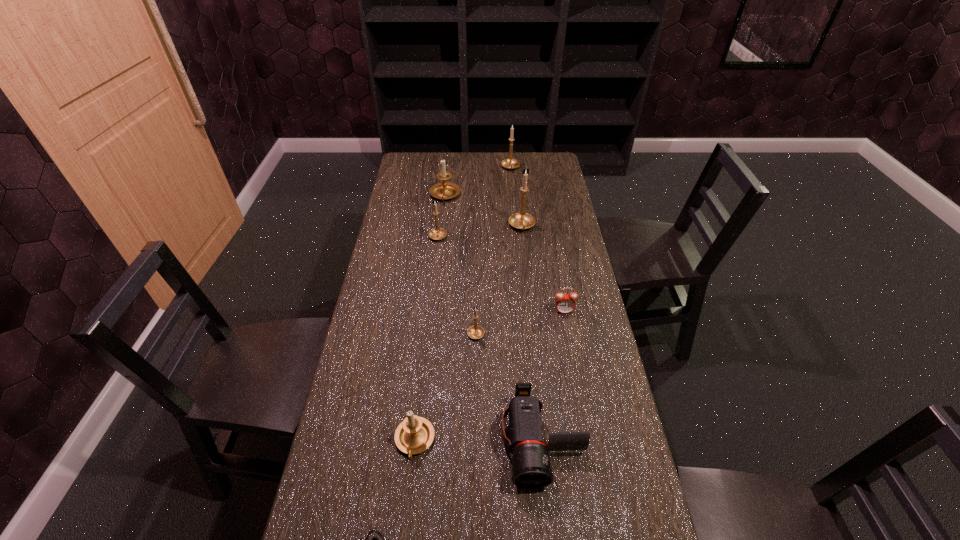
This screenshot has height=540, width=960. Find the location of `free space located 0.080m on the handle side of the nearest gold candle holder`. free space located 0.080m on the handle side of the nearest gold candle holder is located at coordinates (476, 305).

The width and height of the screenshot is (960, 540). I want to click on vacant space situated 0.130m on the handle side of the nearest gold candle holder, so click(476, 294).

At what (x,y) coordinates should I click in order to perform the action: click on free point located 0.060m with a handle on the side of the smaller beige candle holder. Please return your answer as a coordinate pair (x, y). Looking at the image, I should click on (409, 490).

I want to click on free space located on the clock face of the alarm clock, so click(571, 349).

Locate an element on the screen. This screenshot has width=960, height=540. vacant space located 0.100m on the lens of the camcorder is located at coordinates (552, 537).

This screenshot has width=960, height=540. In order to click on object present at the far edge in this screenshot , I will do `click(510, 163)`.

The height and width of the screenshot is (540, 960). Identify the location of candle holder that is at the right edge. (522, 220).

Locate an element on the screen. alarm clock that is at the right edge is located at coordinates (565, 303).

Locate an element on the screen. The height and width of the screenshot is (540, 960). camcorder that is at the right edge is located at coordinates (531, 465).

In the image, there is a desktop. Where is `blank space at the far edge`? The width and height of the screenshot is (960, 540). blank space at the far edge is located at coordinates (512, 171).